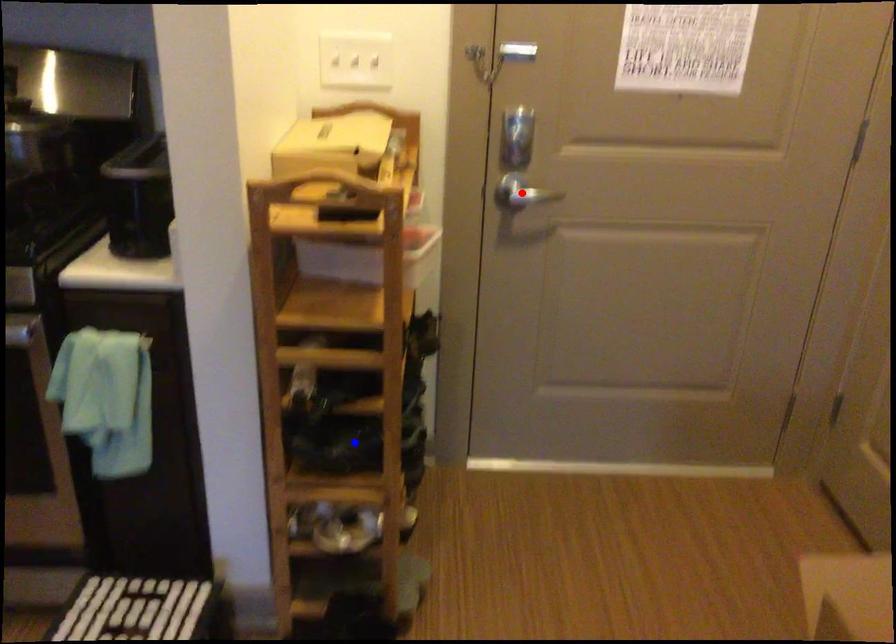
Question: In the image, two points are highlighted. Which point is nearer to the camera? Reply with the corresponding letter.

Choices:
 (A) blue point
 (B) red point

Answer: (A)